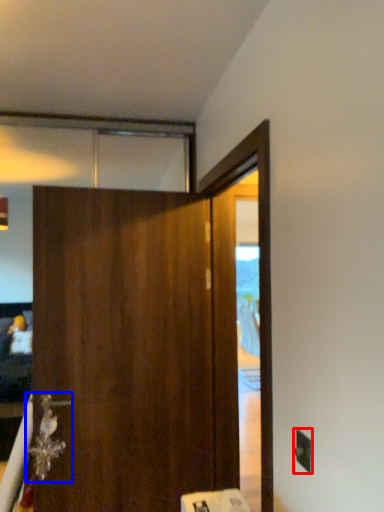
Question: Which object appears farthest to the camera in this image, electric outlet (highlighted by a red box) or door handle (highlighted by a blue box)?

Choices:
 (A) electric outlet
 (B) door handle

Answer: (B)